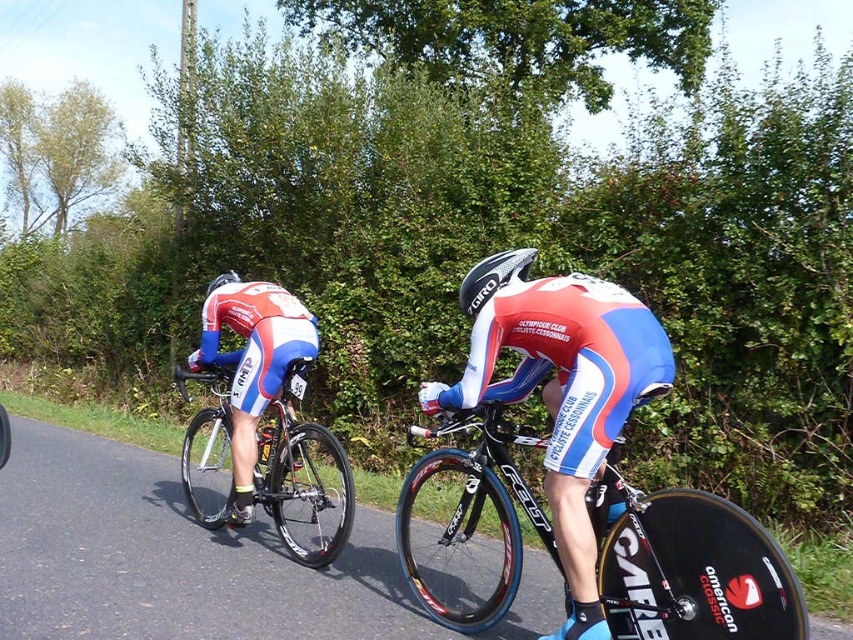
You are a photographer positioned at the starting line of a cycling race. You want to capture both the shiny black frame at center and the matte white helmet at upper left in the same photo. Given that your camera has a maximum focus range of 3 meters, will both subjects be in focus?

The shiny black frame at center is 3.10 meters away from the matte white helmet at upper left. Since the camera can only focus up to 3 meters, the distance between them exceeds the focus range. Therefore, both subjects cannot be in focus simultaneously.

What are the coordinates of the shiny black frame at center?

The coordinates of the shiny black frame at center are at point (688, 564).